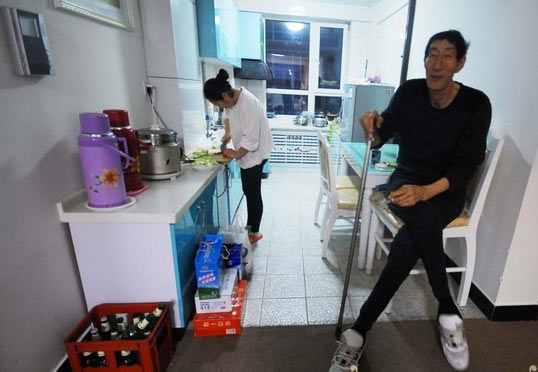
The image size is (538, 372). I want to click on tiles, so click(296, 295), click(286, 256), click(325, 262), click(327, 286), click(327, 309), click(281, 221), click(304, 179).